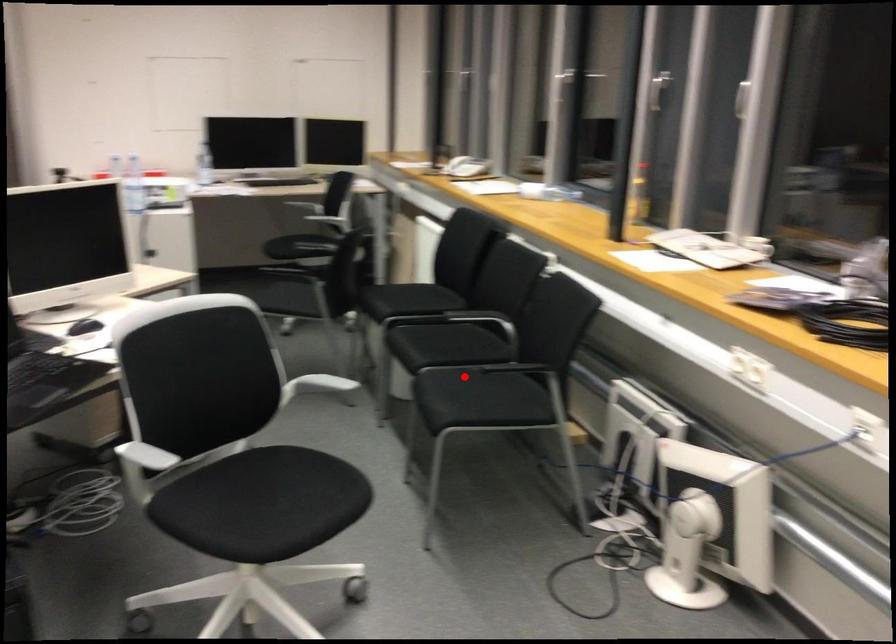
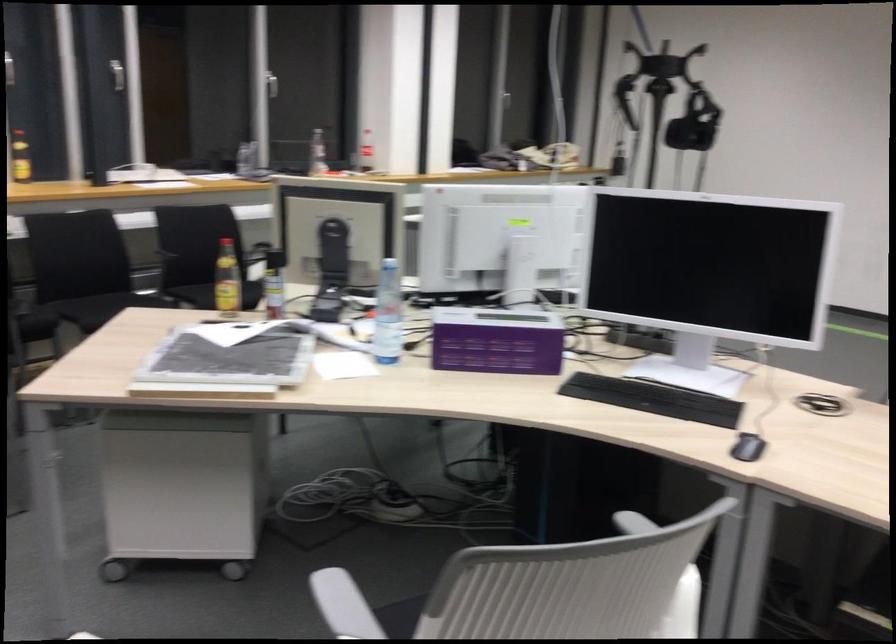
Question: A red point is marked in image1. In image2, is the corresponding 3D point closer to the camera or farther? Reply with the corresponding letter.

Choices:
 (A) The corresponding 3D point is closer.
 (B) The corresponding 3D point is farther.

Answer: (B)